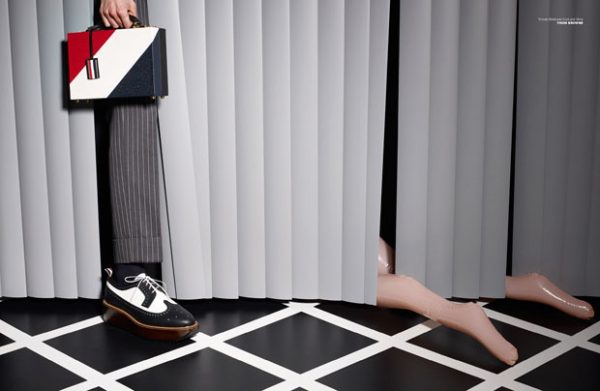
Locate an element on the screen. curtain is located at coordinates (35, 166), (258, 132), (451, 142), (562, 136).